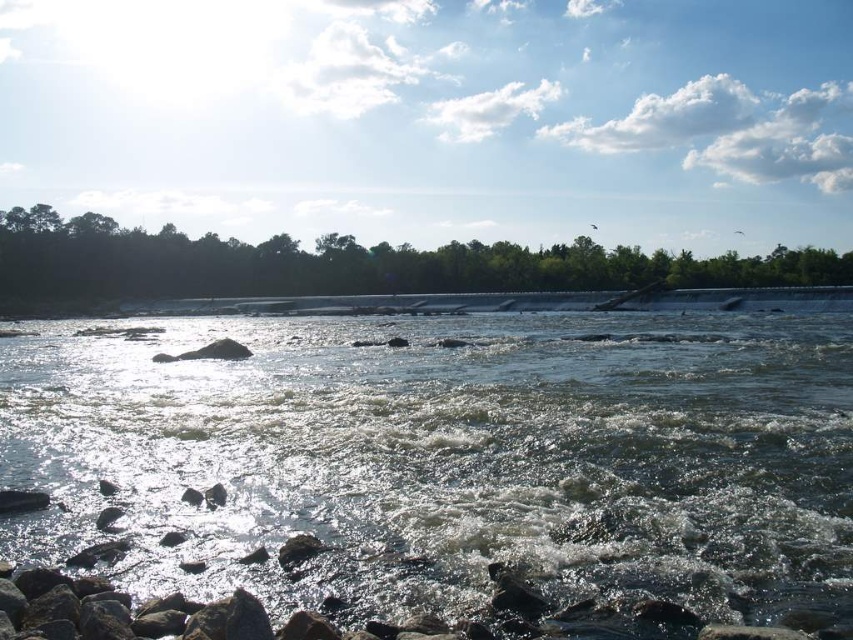
Describe the element at coordinates (451, 458) in the screenshot. The height and width of the screenshot is (640, 853). I see `greenish water at center` at that location.

Which is more to the left, greenish water at center or green leafy trees at upper center?

Positioned to the left is green leafy trees at upper center.

Locate an element on the screen. greenish water at center is located at coordinates (451, 458).

Locate an element on the screen. This screenshot has height=640, width=853. greenish water at center is located at coordinates (451, 458).